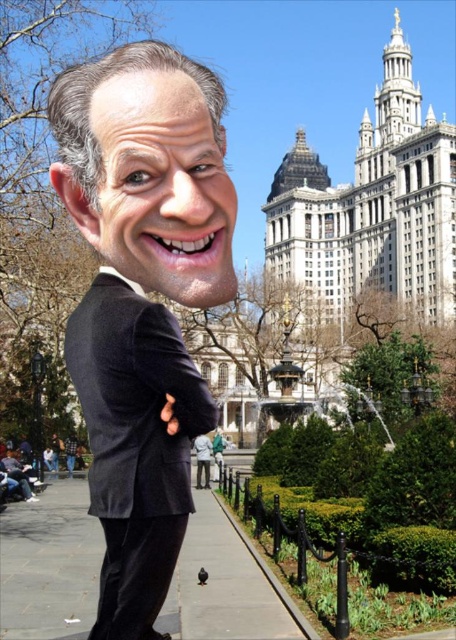
You are an observer in the scene. You notice two objects labeled as black matte suit at center and matte black suit at center. Which one is closer to you?

The black matte suit at center is closer to you because it is in front of the matte black suit at center.

You are a fashion designer observing the image of a man in a park. You notice two suits on him. Which one is on the right side of the other? The black velvet suit at left and the matte black suit at center are both part of his outfit. Please identify their positions relative to each other.

The black velvet suit at left is positioned on the right side of the matte black suit at center, meaning the black velvet suit at left is to the right of the matte black suit at center.

You are a photographer trying to capture the black matte suit at center in the scene. What are the coordinates where you should focus your camera?

The black matte suit at center is located at coordinates point (143, 300).